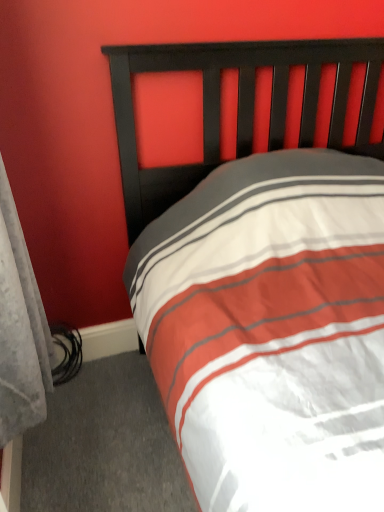
Question: Should I look upward or downward to see velvet gray curtain at left?

Choices:
 (A) down
 (B) up

Answer: (A)